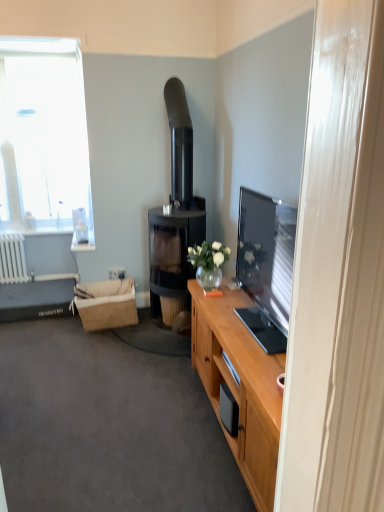
Find the location of `vacant point above white glass window at upper left (from a real-world perspective)`. vacant point above white glass window at upper left (from a real-world perspective) is located at coordinates (48, 54).